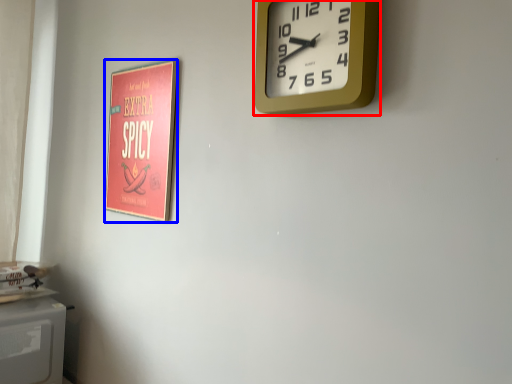
Question: Which object appears farthest to the camera in this image, wall clock (highlighted by a red box) or poster page (highlighted by a blue box)?

Choices:
 (A) wall clock
 (B) poster page

Answer: (B)